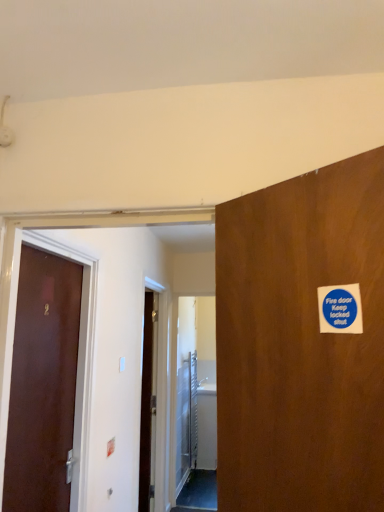
Question: From a real-world perspective, is metallic silver elevator door at center positioned above or below brown matte door at left?

Choices:
 (A) above
 (B) below

Answer: (B)

Question: Considering their positions, is metallic silver elevator door at center located in front of or behind brown matte door at left?

Choices:
 (A) behind
 (B) front

Answer: (A)

Question: Estimate the real-world distances between objects in this image. Which object is farther from the brown matte door at left?

Choices:
 (A) blue paper sticker at upper right
 (B) metallic silver elevator door at center

Answer: (B)

Question: Based on their relative distances, which object is nearer to the blue paper sticker at upper right?

Choices:
 (A) metallic silver elevator door at center
 (B) brown matte door at left

Answer: (B)